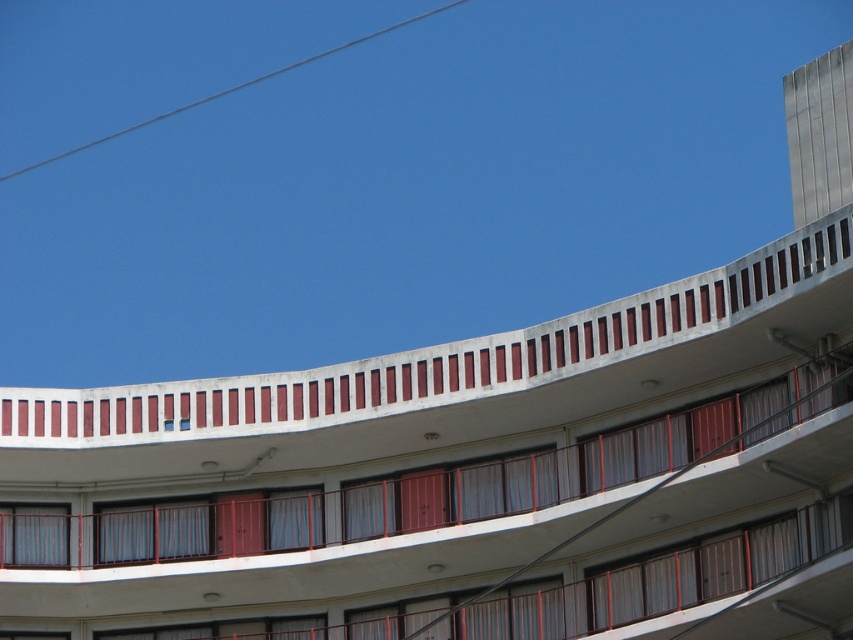
Question: Which object is closer to the camera taking this photo?

Choices:
 (A) gray wire at upper left
 (B) white concrete balcony at upper center

Answer: (B)

Question: Can you confirm if white concrete balcony at upper center is wider than gray wire at upper left?

Choices:
 (A) no
 (B) yes

Answer: (A)

Question: Observing the image, what is the correct spatial positioning of white concrete balcony at upper center in reference to gray wire at upper left?

Choices:
 (A) left
 (B) right

Answer: (B)

Question: Can you confirm if white concrete balcony at upper center is positioned below gray wire at upper left?

Choices:
 (A) yes
 (B) no

Answer: (A)